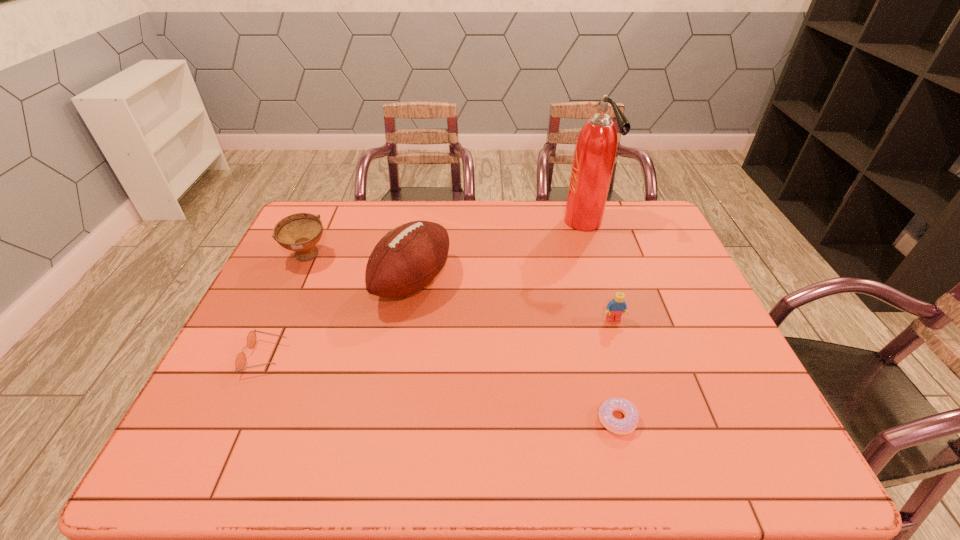
Locate an element on the screen. the tallest object is located at coordinates (595, 151).

What are the coordinates of `the farthest object` in the screenshot? It's located at (595, 151).

Where is `football (American)`? The image size is (960, 540). football (American) is located at coordinates (407, 259).

I want to click on the second tallest object, so click(407, 259).

I want to click on the third tallest object, so click(x=300, y=232).

This screenshot has height=540, width=960. Find the location of `Lego`. Lego is located at coordinates (615, 308).

I want to click on the second shortest object, so click(x=240, y=361).

Identify the location of the fifth farthest object. The image size is (960, 540). (240, 361).

Where is `doughnut`? This screenshot has height=540, width=960. doughnut is located at coordinates (627, 425).

Where is `the shortest object`? the shortest object is located at coordinates (627, 425).